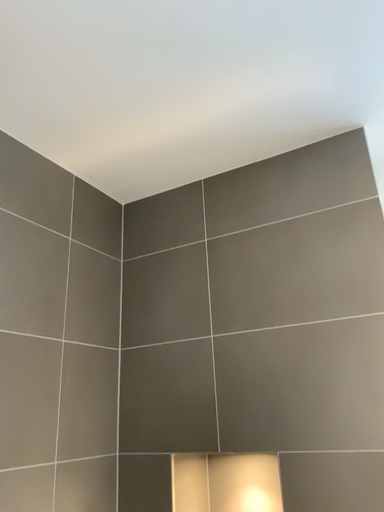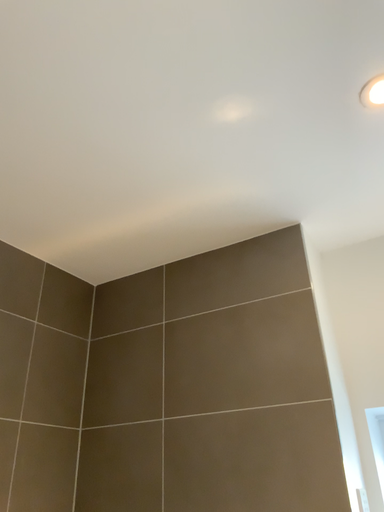
Question: How did the camera likely rotate when shooting the video?

Choices:
 (A) rotated upward
 (B) rotated downward

Answer: (A)